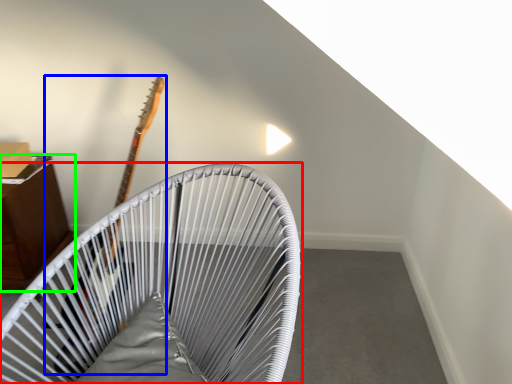
Question: Considering the real-world distances, which object is farthest from furniture (highlighted by a red box)? guitar (highlighted by a blue box) or furniture (highlighted by a green box)?

Choices:
 (A) guitar
 (B) furniture

Answer: (B)